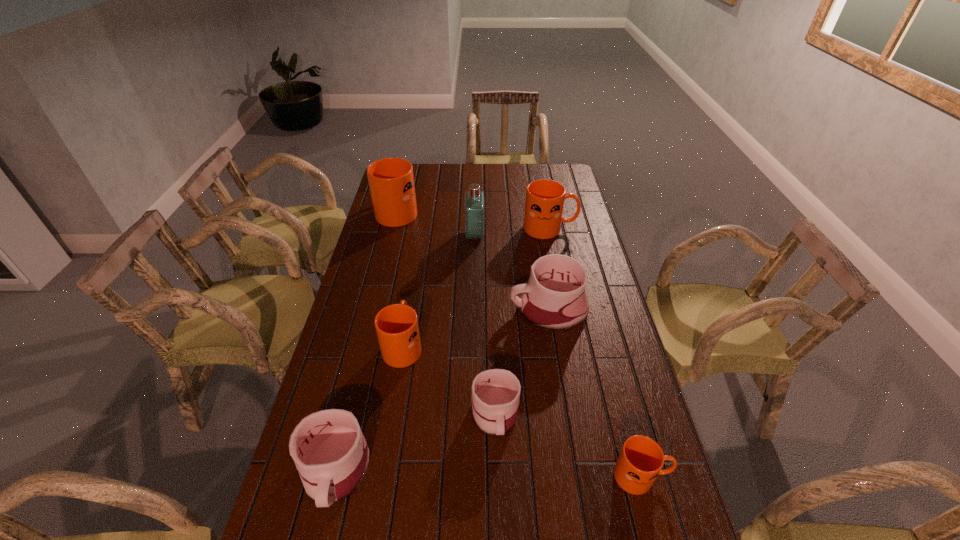
In order to click on perfume in this screenshot , I will do `click(474, 205)`.

Locate an element on the screen. This screenshot has width=960, height=540. the biggest orange mug is located at coordinates click(391, 181).

Identify the location of the third smallest orange mug. The image size is (960, 540). (544, 204).

Find the location of a particular element. the third tallest object is located at coordinates (544, 204).

In order to click on the biggest white mug in this screenshot , I will do `click(554, 298)`.

I want to click on the third biggest orange mug, so click(x=397, y=329).

Find the location of `the second smallest white mug`. the second smallest white mug is located at coordinates (331, 455).

You are a GUI agent. You are given a task and a screenshot of the screen. Output one action in this format:
    pyautogui.click(x=<x>, y=<y>)
    Task: Click on the nearest orange mug
    
    Given the screenshot: What is the action you would take?
    pyautogui.click(x=641, y=459)

Find the location of a particular element. the smallest white mug is located at coordinates (x=495, y=393).

At what (x,y) coordinates should I click in order to perform the action: click on free spot located on the front label of the perfume. Please return your answer as a coordinate pair (x, y). Looking at the image, I should click on (562, 235).